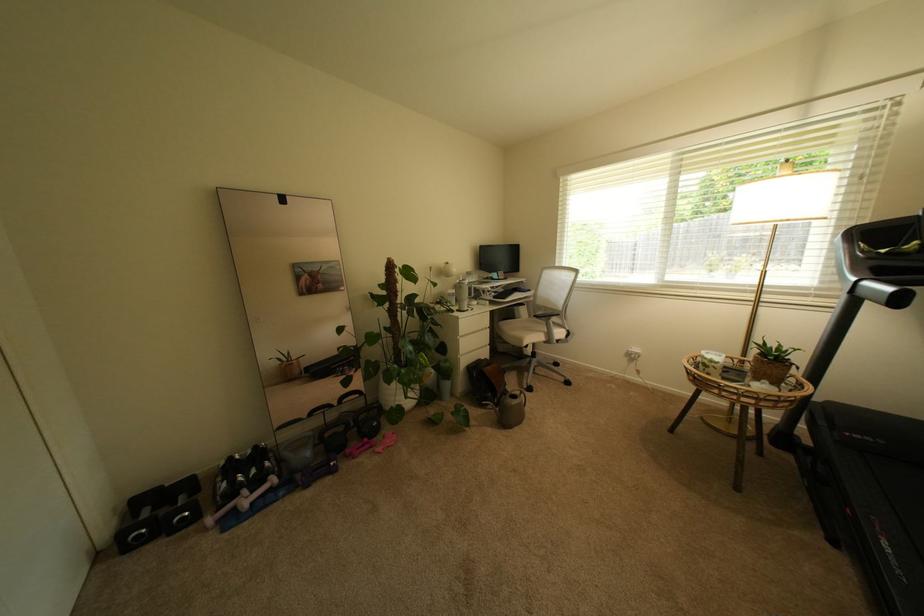
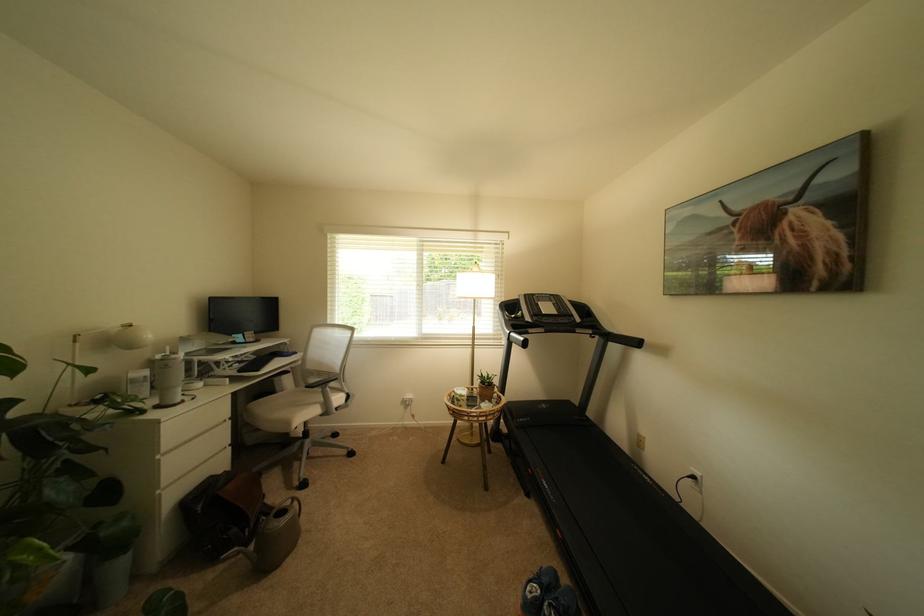
Question: Based on the continuous images, in which direction is the camera rotating? Reply with the corresponding letter.

Choices:
 (A) Left
 (B) Right
 (C) Up
 (D) Down

Answer: (B)